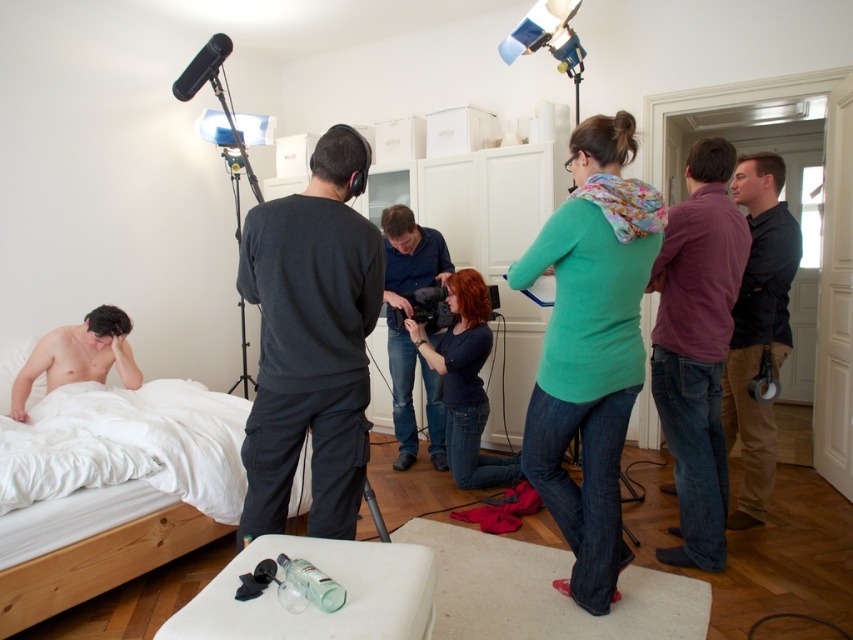
In the scene shown: Can you confirm if green matte shirt at center is positioned above blue jeans at center?

Actually, green matte shirt at center is below blue jeans at center.

Can you confirm if green matte shirt at center is positioned below blue jeans at center?

Indeed, green matte shirt at center is positioned under blue jeans at center.

Which is behind, point (570, 250) or point (393, 372)?

Point (393, 372)

Where is `green matte shirt at center`? The width and height of the screenshot is (853, 640). green matte shirt at center is located at coordinates (590, 348).

Which is below, dark purple shirt at center or white wood bed at lower left?

white wood bed at lower left

Describe the element at coordinates (758, 326) in the screenshot. I see `dark purple shirt at center` at that location.

Who is more forward, (746, 385) or (368, 490)?

Positioned in front is point (368, 490).

The width and height of the screenshot is (853, 640). What are the coordinates of `dark purple shirt at center` in the screenshot? It's located at (758, 326).

Does dark gray sweater at center come behind dark blue sweater at center?

No, dark gray sweater at center is closer to the viewer.

Which is below, dark gray sweater at center or dark blue sweater at center?

dark blue sweater at center is below.

Is point (280, 364) positioned in front of point (448, 433)?

Yes, point (280, 364) is closer to viewer.

You are a GUI agent. You are given a task and a screenshot of the screen. Output one action in this format:
    pyautogui.click(x=<x>, y=<y>)
    Task: Click on the dark gray sweater at center
    Image resolution: width=853 pixels, height=640 pixels.
    Given the screenshot: What is the action you would take?
    pyautogui.click(x=311, y=342)